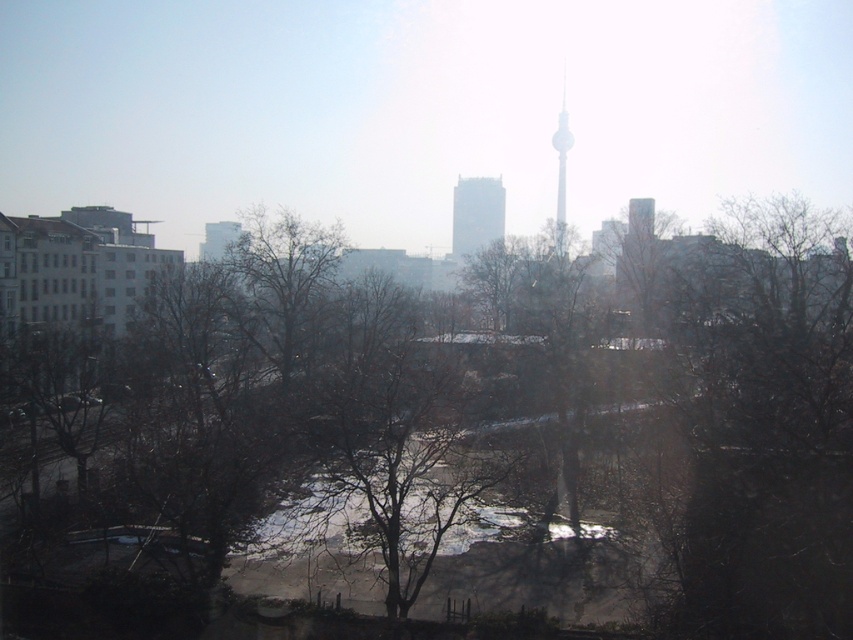
The height and width of the screenshot is (640, 853). What do you see at coordinates (442, 433) in the screenshot?
I see `brown leafless tree at center` at bounding box center [442, 433].

The image size is (853, 640). I want to click on brown leafless tree at center, so click(x=442, y=433).

You are a GUI agent. You are given a task and a screenshot of the screen. Output one action in this format:
    pyautogui.click(x=<x>, y=<y>)
    Task: Click on the brown leafless tree at center
    The width and height of the screenshot is (853, 640).
    Given the screenshot: What is the action you would take?
    pyautogui.click(x=442, y=433)

Find the location of a particular element. Image resolution: width=853 pixels, height=640 pixels. smooth glass skyscraper at center is located at coordinates (476, 214).

Is point (456, 198) positioned behind point (556, 141)?

No, (456, 198) is in front of (556, 141).

Is point (492, 237) less distant than point (560, 168)?

Yes, it is.

I want to click on smooth glass skyscraper at center, so click(476, 214).

What are the coordinates of `brown leafless tree at center` in the screenshot? It's located at (442, 433).

Which is behind, point (163, 605) or point (560, 236)?

The point (560, 236) is behind.

This screenshot has height=640, width=853. What are the coordinates of `brown leafless tree at center` in the screenshot? It's located at (442, 433).